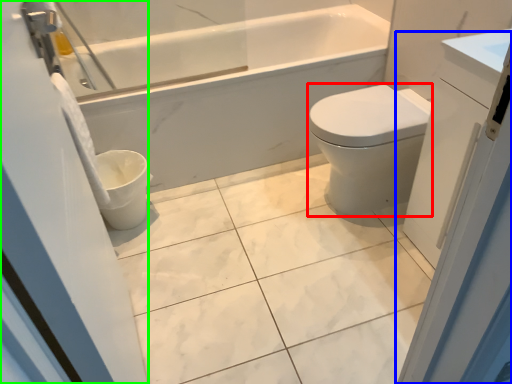
Question: Which object is the closest to the bidet (highlighted by a red box)? Choose among these: screen door (highlighted by a blue box) or screen door (highlighted by a green box).

Choices:
 (A) screen door
 (B) screen door

Answer: (A)